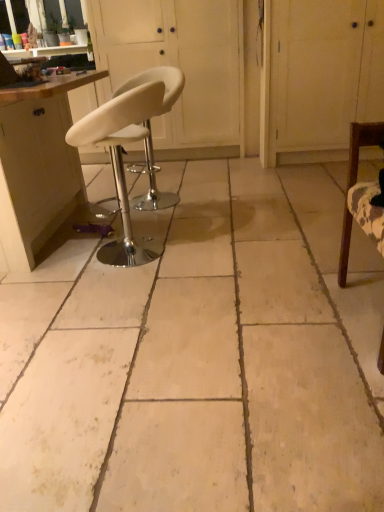
Question: From the image's perspective, is white leather stool at center, placed as the second screen door when sorted from right to left, located above or below beige tile floor at center?

Choices:
 (A) above
 (B) below

Answer: (A)

Question: Based on their positions, is white leather stool at center, the first screen door from the left, located to the left or right of beige tile floor at center?

Choices:
 (A) left
 (B) right

Answer: (A)

Question: Estimate the real-world distances between objects in this image. Which object is farther from the white leather stool at center, placed as the second screen door when sorted from right to left?

Choices:
 (A) white wood cabinet at upper right, positioned as the 2th screen door in left-to-right order
 (B) white leather stool at center, the 2th chair when ordered from front to back
 (C) wooden chair at right, the third chair positioned from the left
 (D) beige tile floor at center
 (E) white leather stool at center, which is counted as the 2th chair, starting from the right

Answer: (C)

Question: Which of these objects is positioned closest to the white wood cabinet at upper right, the 1th screen door viewed from the right?

Choices:
 (A) white leather stool at center, the 2th chair when ordered from front to back
 (B) white leather stool at center, placed as the second screen door when sorted from right to left
 (C) wooden chair at right, the third chair positioned from the left
 (D) white leather stool at center, which is counted as the 2th chair, starting from the right
 (E) matte wood cabinet at left

Answer: (B)